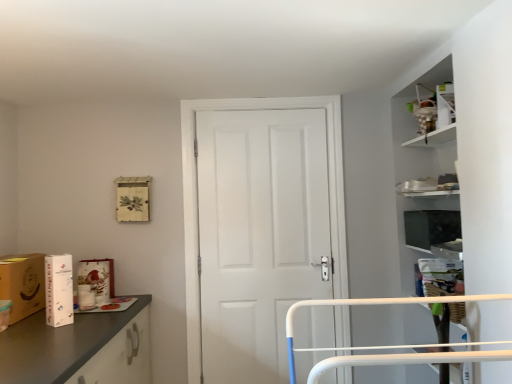
Question: Considering the positions of point (10, 264) and point (82, 274), is point (10, 264) closer or farther from the camera than point (82, 274)?

Choices:
 (A) closer
 (B) farther

Answer: (A)

Question: Considering the positions of matte brown cardboard box at left, which is the first cardboard box from left to right, and white cardboard box at left in the image, is matte brown cardboard box at left, which is the first cardboard box from left to right, bigger or smaller than white cardboard box at left?

Choices:
 (A) small
 (B) big

Answer: (B)

Question: Based on their relative distances, which object is farther from the matte brown cardboard box at left, arranged as the second cardboard box when viewed from the right?

Choices:
 (A) white matte cardboard box at left, the first cardboard box positioned from the right
 (B) white matte door at center
 (C) white cardboard box at left

Answer: (B)

Question: Estimate the real-world distances between objects in this image. Which object is farther from the matte brown cardboard box at left, arranged as the second cardboard box when viewed from the right?

Choices:
 (A) white matte cardboard box at left, the first cardboard box positioned from the right
 (B) white matte door at center
 (C) white cardboard box at left

Answer: (B)